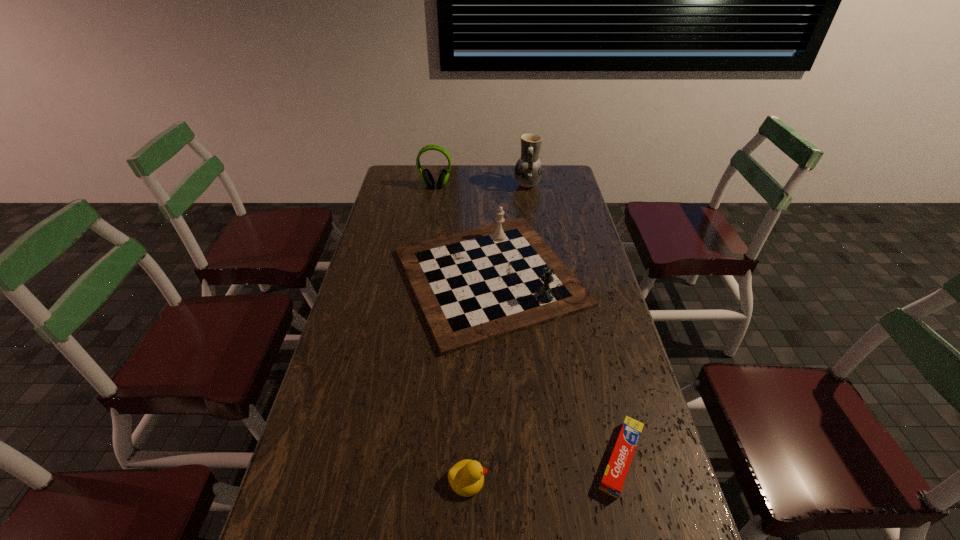
Locate an element on the screen. This screenshot has height=540, width=960. vacant space situated 0.180m on the back of the gameboard is located at coordinates (487, 198).

Where is `vacant space situated 0.370m on the face of the second shortest object`? vacant space situated 0.370m on the face of the second shortest object is located at coordinates (647, 480).

Where is `vacant space situated 0.350m on the back of the shortest object`? vacant space situated 0.350m on the back of the shortest object is located at coordinates (588, 323).

I want to click on pottery at the far edge, so (528, 170).

Locate an element on the screen. headset positioned at the far edge is located at coordinates (427, 178).

Where is `headset that is at the left edge`? This screenshot has height=540, width=960. headset that is at the left edge is located at coordinates (427, 178).

I want to click on gameboard present at the left edge, so click(x=475, y=286).

The width and height of the screenshot is (960, 540). I want to click on pottery present at the right edge, so click(528, 170).

The image size is (960, 540). Identify the location of gameboard that is at the right edge. (475, 286).

Where is `toothpaste situated at the right edge`? This screenshot has height=540, width=960. toothpaste situated at the right edge is located at coordinates (615, 474).